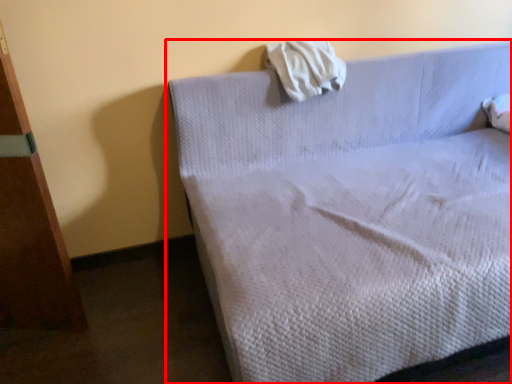
Question: From the image, what is the correct spatial relationship of bed (annotated by the red box) in relation to cloth?

Choices:
 (A) right
 (B) left

Answer: (A)